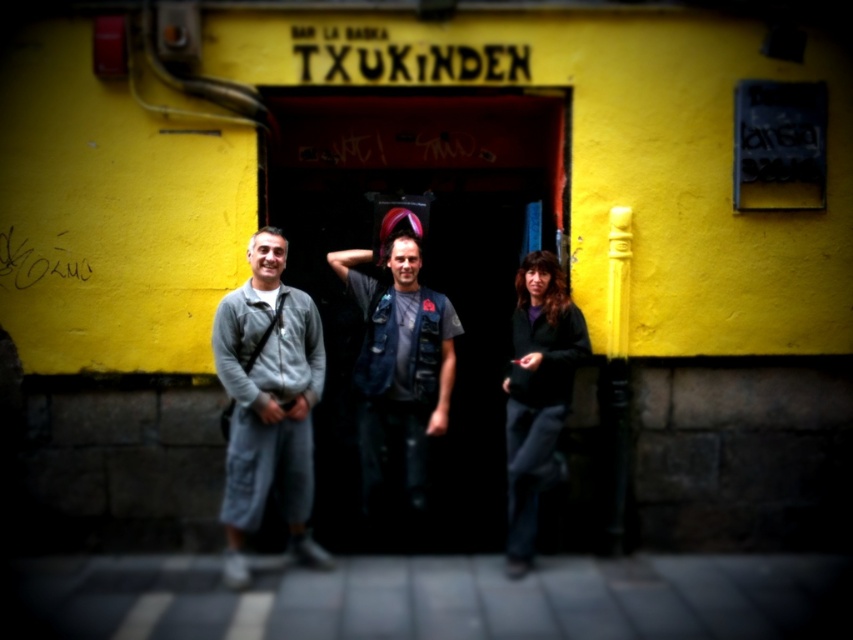
You are a photographer trying to capture a photo of the TXUKINDEN building entrance. You notice two clothing items in the scene, the denim vest at center and the dark gray sweater at lower right. Which clothing item should you focus on to ensure it appears larger in your photo?

The denim vest at center is taller than the dark gray sweater at lower right, so focusing on the denim vest at center will make it appear larger in the photo.

You are a photographer trying to capture a candid shot of the denim vest at center without including the gray fabric pants at left in the frame. Based on their positions, is this possible?

The gray fabric pants at left are to the left of the denim vest at center, so if you position yourself to the right side of the denim vest at center, you can frame the shot to exclude the gray fabric pants at left.